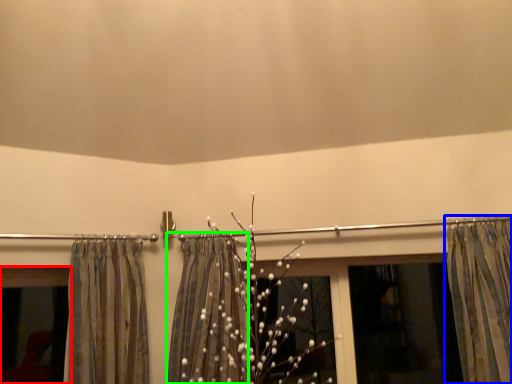
Question: Estimate the real-world distances between objects in this image. Which object is closer to window (highlighted by a red box), curtain (highlighted by a blue box) or shower curtain (highlighted by a green box)?

Choices:
 (A) curtain
 (B) shower curtain

Answer: (B)